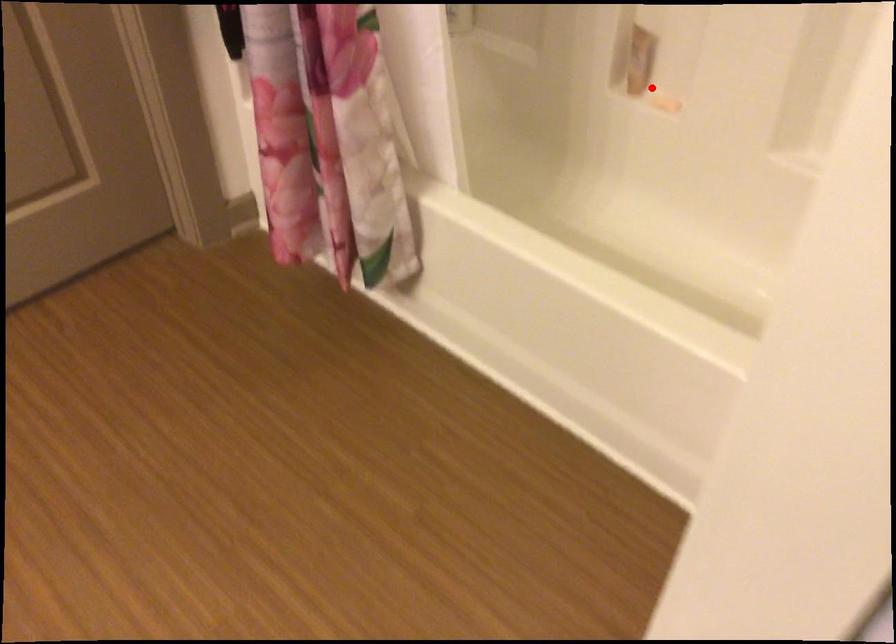
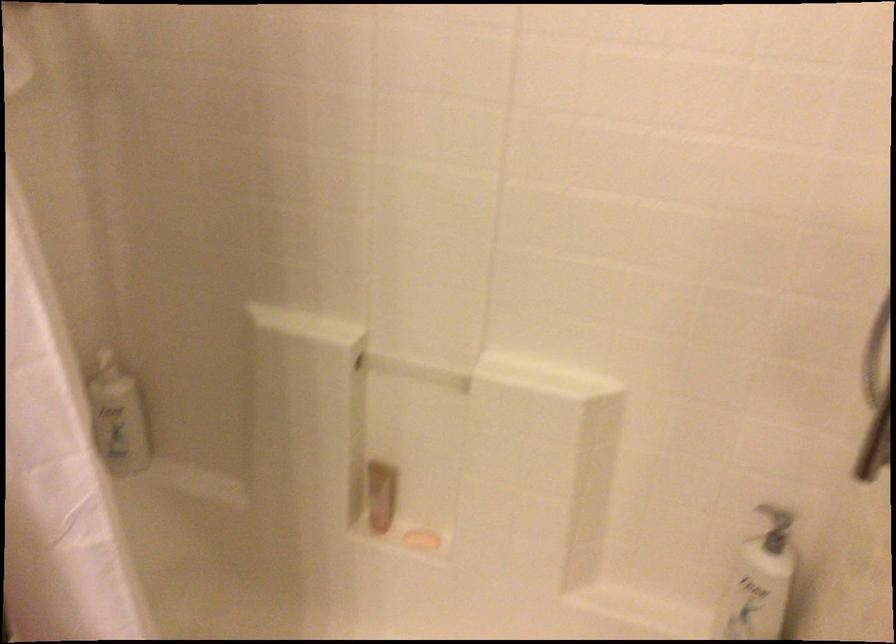
Question: I am providing you with two images of the same scene from different viewpoints. Image1 has a red point marked. In image2, the corresponding 3D location appears at what relative position? Reply with the corresponding letter.

Choices:
 (A) Closer
 (B) Farther

Answer: (A)